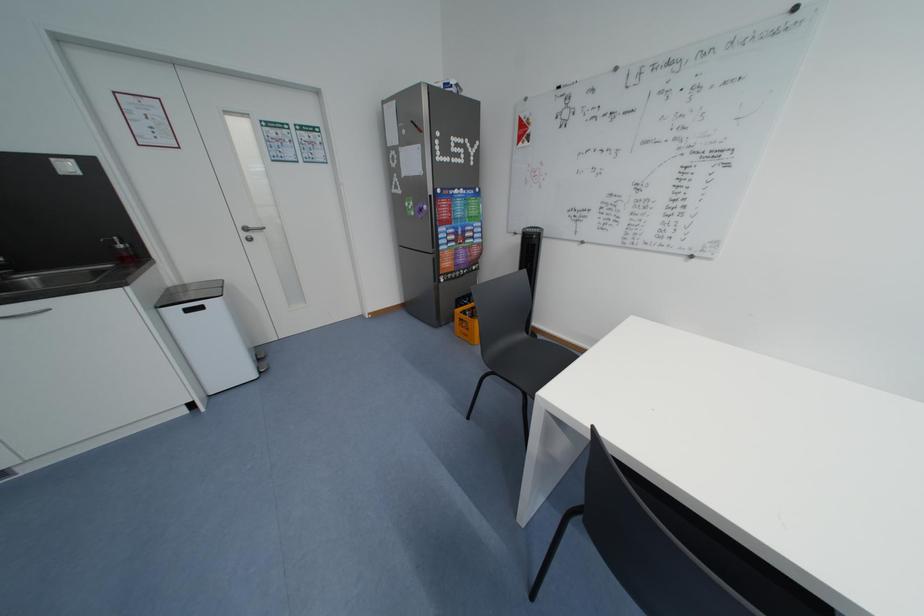
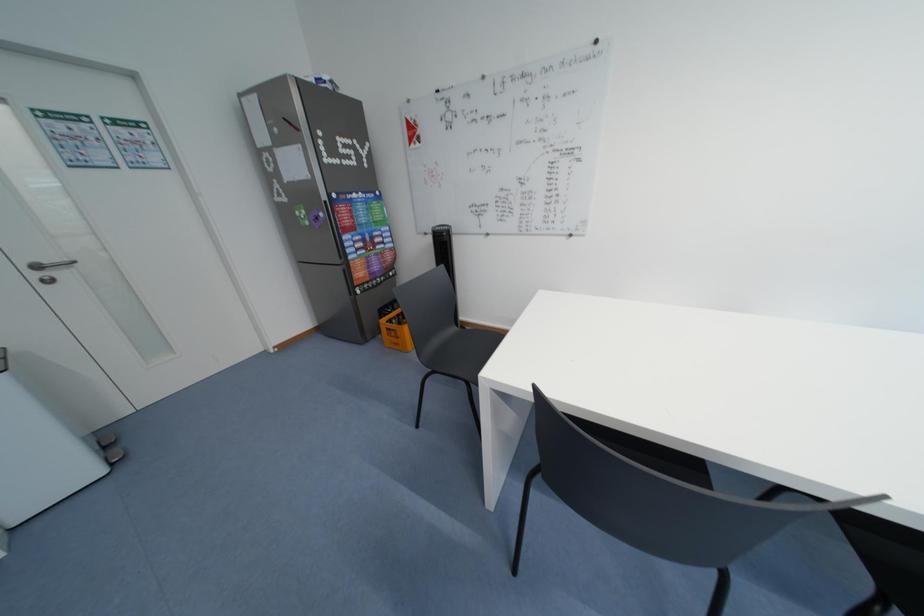
Question: The camera is either moving clockwise (left) or counter-clockwise (right) around the object. The first image is from the beginning of the video and the second image is from the end. Is the camera moving left or right when shooting the video?

Choices:
 (A) Left
 (B) Right

Answer: (A)